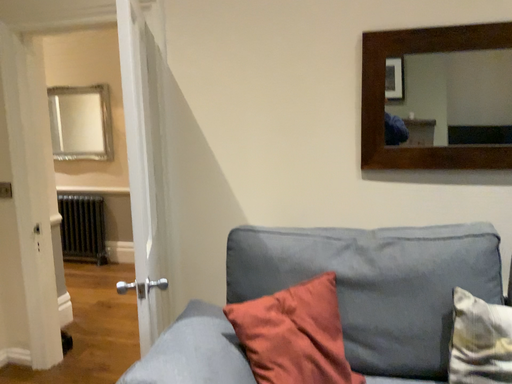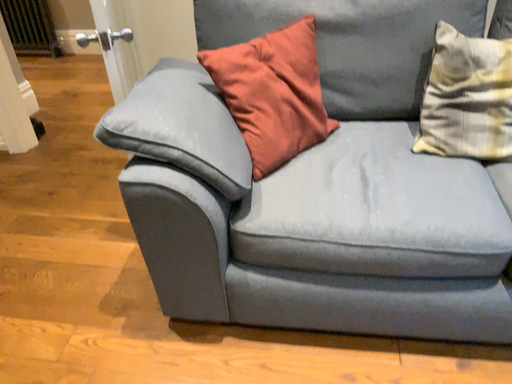
Question: How did the camera likely rotate when shooting the video?

Choices:
 (A) rotated downward
 (B) rotated upward

Answer: (A)